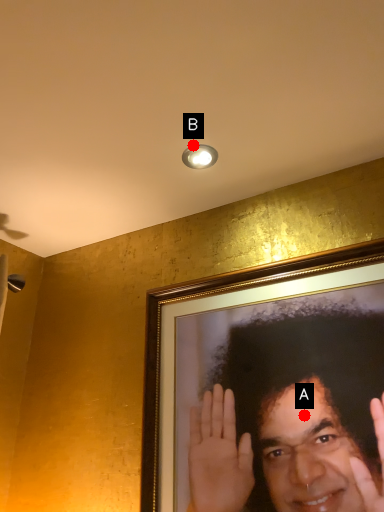
Question: Two points are circled on the image, labeled by A and B beside each circle. Which of the following is the closest to the observer?

Choices:
 (A) A is closer
 (B) B is closer

Answer: (A)